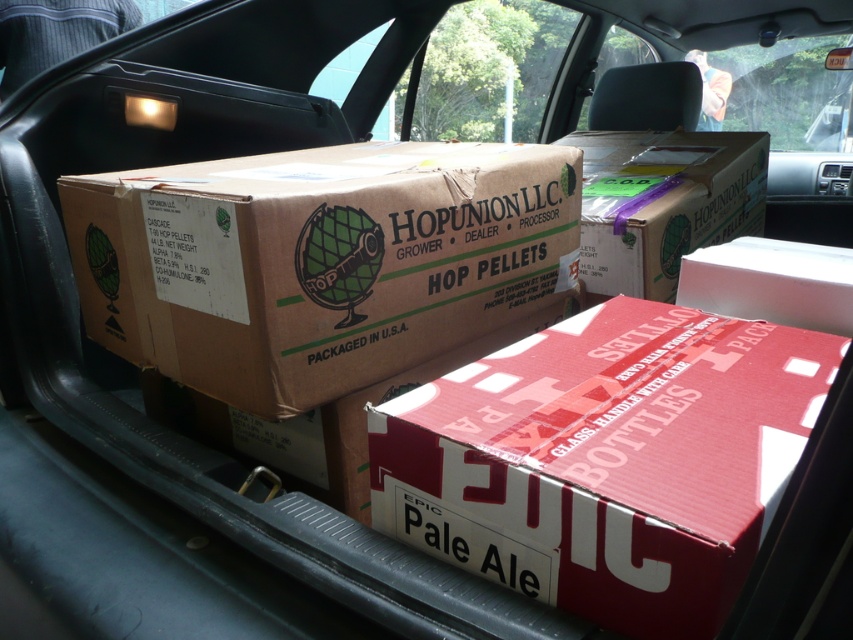
Question: Can you confirm if brown cardboard box at center is positioned to the right of brown cardboard box at upper center?

Choices:
 (A) yes
 (B) no

Answer: (B)

Question: Can you confirm if red cardboard box at center is smaller than brown cardboard box at upper center?

Choices:
 (A) yes
 (B) no

Answer: (A)

Question: Can you confirm if brown cardboard box at center is positioned above brown cardboard box at upper center?

Choices:
 (A) no
 (B) yes

Answer: (A)

Question: Based on their relative distances, which object is nearer to the brown cardboard box at upper center?

Choices:
 (A) red cardboard box at center
 (B) brown cardboard box at center

Answer: (B)

Question: Which of the following is the farthest from the observer?

Choices:
 (A) (296, 316)
 (B) (776, 396)
 (C) (605, 216)

Answer: (C)

Question: Considering the real-world distances, which object is farthest from the brown cardboard box at center?

Choices:
 (A) red cardboard box at center
 (B) brown cardboard box at upper center

Answer: (B)